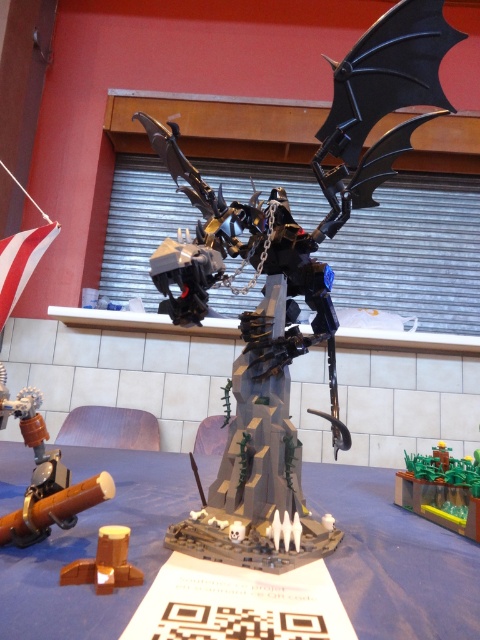
Who is positioned more to the right, blue fabric table at center or green plastic plant at center?

Positioned to the right is green plastic plant at center.

Measure the distance from blue fabric table at center to green plastic plant at center.

blue fabric table at center is 9.25 inches away from green plastic plant at center.

Identify the location of blue fabric table at center. [395, 560].

Between point (20, 413) and point (450, 480), which one is positioned behind?

The point (450, 480) is more distant.

Identify the location of brushed metal pipe at lower left. (44, 476).

Is point (236, 291) closer to viewer compared to point (3, 609)?

No.

Find the location of a particular element. This screenshot has width=480, height=640. black matte dragon at center is located at coordinates pos(289,289).